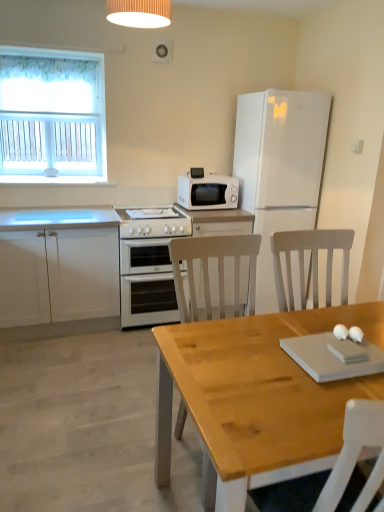
Question: Based on their sizes in the image, would you say white matte refrigerator at upper right is bigger or smaller than white glossy oven at center?

Choices:
 (A) small
 (B) big

Answer: (B)

Question: From a real-world perspective, is white matte refrigerator at upper right positioned above or below white glossy oven at center?

Choices:
 (A) above
 (B) below

Answer: (A)

Question: Estimate the real-world distances between objects in this image. Which object is farther from the wooden table at center?

Choices:
 (A) white matte microwave at upper center
 (B) white glossy oven at center
 (C) white matte cabinet at lower left
 (D) white ribbed lampshade at upper center
 (E) white matte refrigerator at upper right

Answer: (D)

Question: Which is farther from the white matte refrigerator at upper right?

Choices:
 (A) white ribbed lampshade at upper center
 (B) white matte microwave at upper center
 (C) white glossy gas stove at center
 (D) wooden table at center
 (E) white fabric curtain at upper left

Answer: (D)